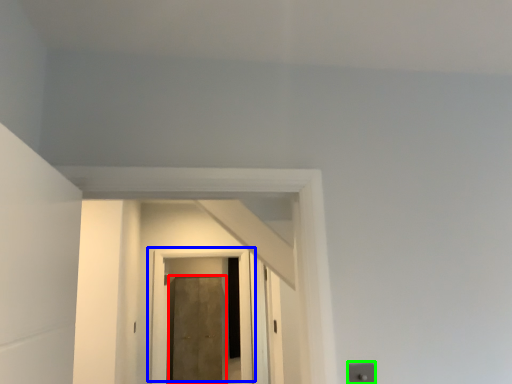
Question: Which is farther away from door (highlighted by a red box)? door (highlighted by a blue box) or electric outlet (highlighted by a green box)?

Choices:
 (A) door
 (B) electric outlet

Answer: (B)